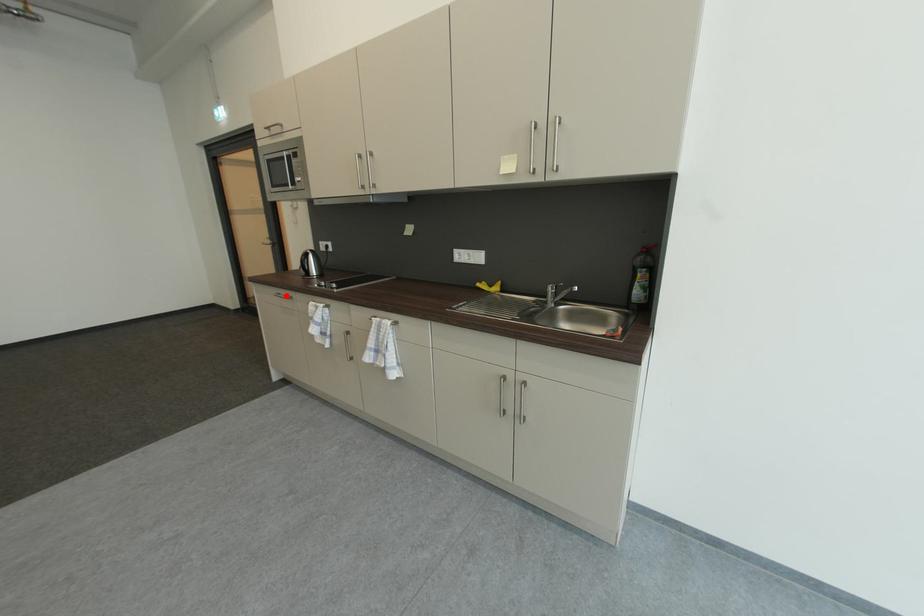
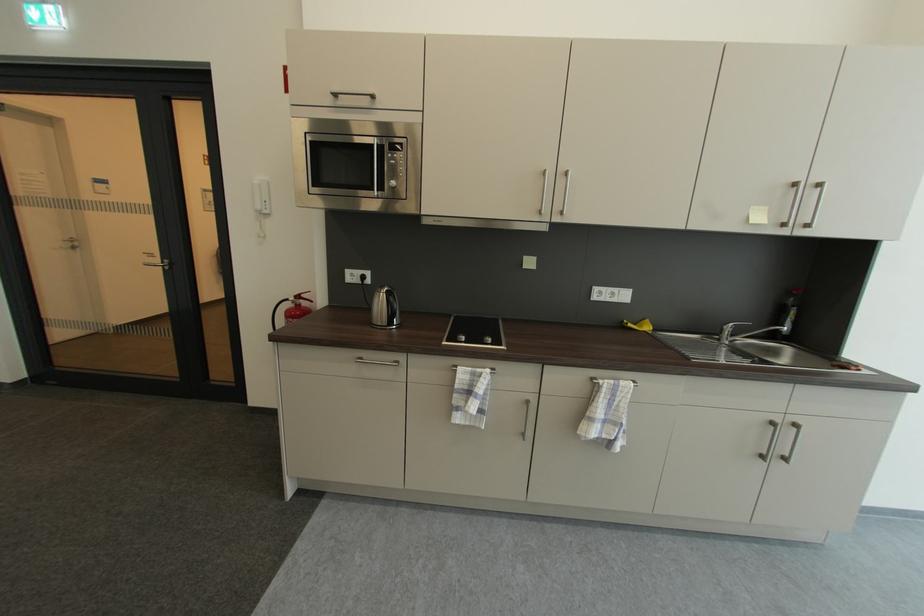
Find the pixel in the second image that matches the highlighted location in the first image.

(367, 360)